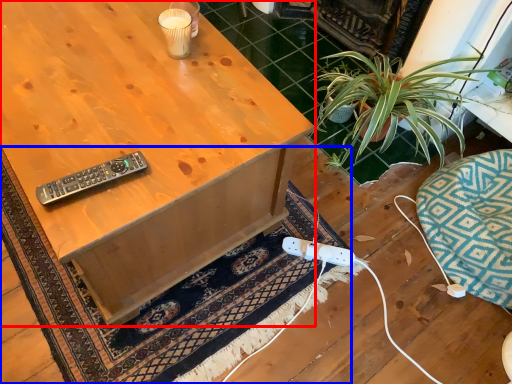
Question: Which object appears farthest to the camera in this image, desk (highlighted by a red box) or doormat (highlighted by a blue box)?

Choices:
 (A) desk
 (B) doormat

Answer: (B)